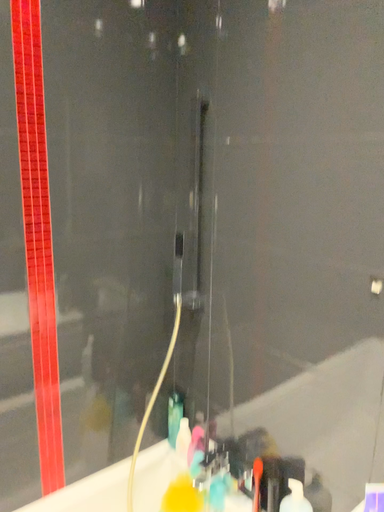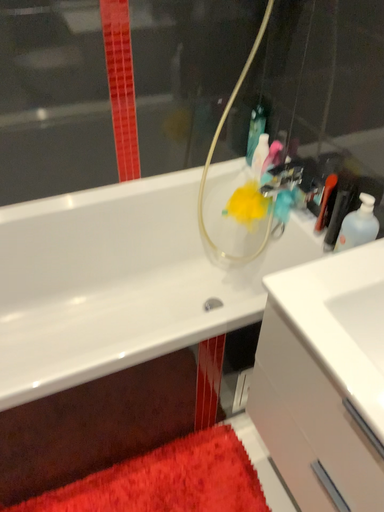
Question: How did the camera likely rotate when shooting the video?

Choices:
 (A) rotated left
 (B) rotated right

Answer: (A)